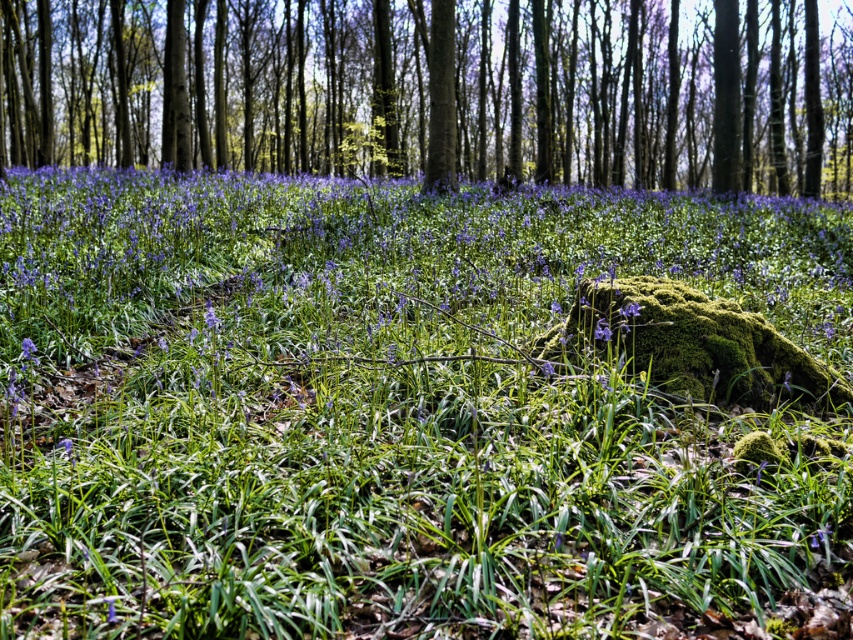
You are a gardener looking at this woodland scene. You notice the green grass at center and the purple matte flower at center. Which one is positioned higher in the image?

The green grass at center is above the purple matte flower at center in the image.